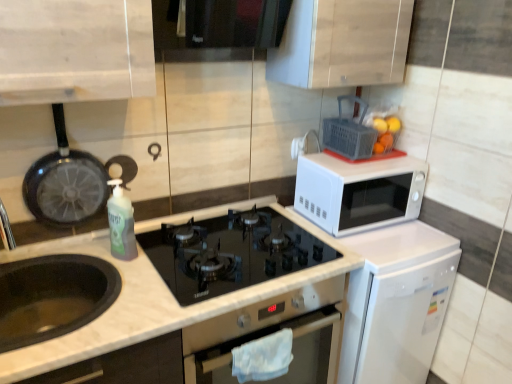
You are a GUI agent. You are given a task and a screenshot of the screen. Output one action in this format:
    pyautogui.click(x=<x>, y=<y>)
    Task: Click on the free location to the left of translucent plastic bottle at center-left
    The image size is (512, 384).
    Given the screenshot: What is the action you would take?
    pyautogui.click(x=79, y=252)